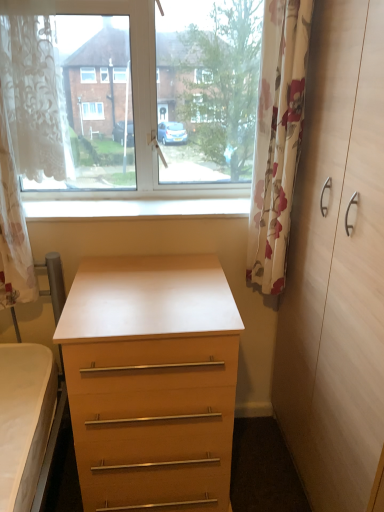
Question: Considering the relative sizes of white lace curtain at left, the first curtain positioned from the left, and floral fabric curtain at right, which is the 1th curtain from right to left, in the image provided, is white lace curtain at left, the first curtain positioned from the left, bigger than floral fabric curtain at right, which is the 1th curtain from right to left,?

Choices:
 (A) no
 (B) yes

Answer: (B)

Question: Does white lace curtain at left, the first curtain positioned from the left, have a greater width compared to floral fabric curtain at right, arranged as the second curtain when viewed from the left?

Choices:
 (A) no
 (B) yes

Answer: (B)

Question: Is floral fabric curtain at right, arranged as the second curtain when viewed from the left, inside white lace curtain at left, which is the 2th curtain from right to left?

Choices:
 (A) yes
 (B) no

Answer: (B)

Question: From the image's perspective, does white lace curtain at left, the first curtain positioned from the left, appear higher than floral fabric curtain at right, arranged as the second curtain when viewed from the left?

Choices:
 (A) no
 (B) yes

Answer: (A)

Question: Considering the relative sizes of white lace curtain at left, which is the 2th curtain from right to left, and floral fabric curtain at right, arranged as the second curtain when viewed from the left, in the image provided, is white lace curtain at left, which is the 2th curtain from right to left, shorter than floral fabric curtain at right, arranged as the second curtain when viewed from the left,?

Choices:
 (A) yes
 (B) no

Answer: (A)

Question: Considering the positions of point (24, 78) and point (198, 508), is point (24, 78) closer or farther from the camera than point (198, 508)?

Choices:
 (A) closer
 (B) farther

Answer: (A)

Question: Do you think white lace curtain at left, the first curtain positioned from the left, is within matte wood chest of drawers at center, or outside of it?

Choices:
 (A) outside
 (B) inside

Answer: (A)

Question: Considering the relative positions of white lace curtain at left, which is the 2th curtain from right to left, and matte wood chest of drawers at center in the image provided, is white lace curtain at left, which is the 2th curtain from right to left, to the left or to the right of matte wood chest of drawers at center?

Choices:
 (A) left
 (B) right

Answer: (A)

Question: From their relative heights in the image, would you say white lace curtain at left, which is the 2th curtain from right to left, is taller or shorter than matte wood chest of drawers at center?

Choices:
 (A) tall
 (B) short

Answer: (A)

Question: From a real-world perspective, is light wood dresser at right physically located above or below transparent glass window at upper center?

Choices:
 (A) below
 (B) above

Answer: (A)

Question: Is light wood dresser at right inside the boundaries of transparent glass window at upper center, or outside?

Choices:
 (A) outside
 (B) inside

Answer: (A)

Question: Does point (337, 266) appear closer or farther from the camera than point (233, 212)?

Choices:
 (A) farther
 (B) closer

Answer: (B)

Question: In terms of size, does light wood dresser at right appear bigger or smaller than transparent glass window at upper center?

Choices:
 (A) small
 (B) big

Answer: (B)

Question: Is floral fabric curtain at right, which is the 1th curtain from right to left, wider or thinner than light wood dresser at right?

Choices:
 (A) wide
 (B) thin

Answer: (B)

Question: Based on their sizes in the image, would you say floral fabric curtain at right, which is the 1th curtain from right to left, is bigger or smaller than light wood dresser at right?

Choices:
 (A) big
 (B) small

Answer: (B)